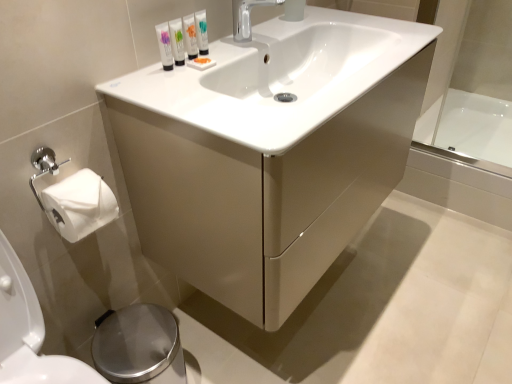
The image size is (512, 384). I want to click on unoccupied region to the right of white glossy tube at upper center, placed as the fourth mouthwash when sorted from right to left, so click(x=222, y=68).